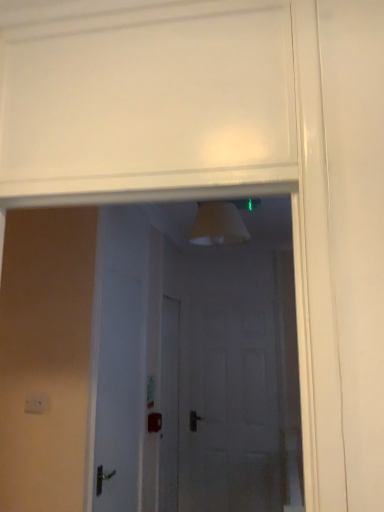
Question: Looking at their shapes, would you say white matte door at center is wider or thinner than white matte door at center?

Choices:
 (A) thin
 (B) wide

Answer: (B)

Question: Is white matte door at center inside or outside of white matte door at center?

Choices:
 (A) inside
 (B) outside

Answer: (B)

Question: In terms of height, does white matte door at center look taller or shorter compared to white matte door at center?

Choices:
 (A) short
 (B) tall

Answer: (B)

Question: In terms of width, does white matte door at center look wider or thinner when compared to white matte door at center?

Choices:
 (A) thin
 (B) wide

Answer: (A)

Question: Visually, is white matte door at center positioned to the left or to the right of white matte door at center?

Choices:
 (A) left
 (B) right

Answer: (A)

Question: Considering the positions of white matte door at center and white matte door at center in the image, is white matte door at center taller or shorter than white matte door at center?

Choices:
 (A) short
 (B) tall

Answer: (A)

Question: From a real-world perspective, is white matte door at center physically located above or below white matte door at center?

Choices:
 (A) below
 (B) above

Answer: (B)